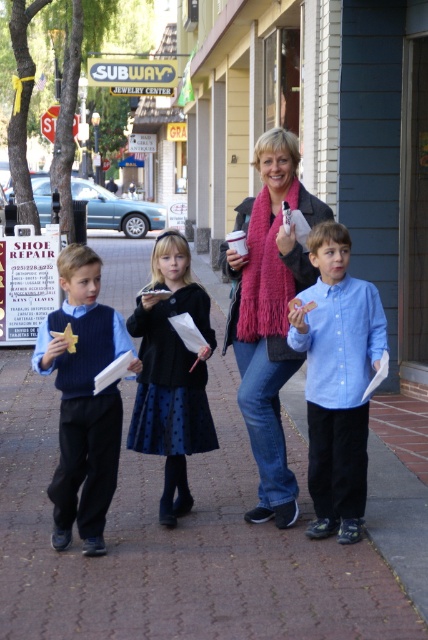
You are a delivery person trying to place a package on the ground. You see the brown brick pavement at center and the matte blue sweater at left. Which surface can you place the package on?

The brown brick pavement at center is positioned under the matte blue sweater at left, so the package can be placed on the brown brick pavement at center.